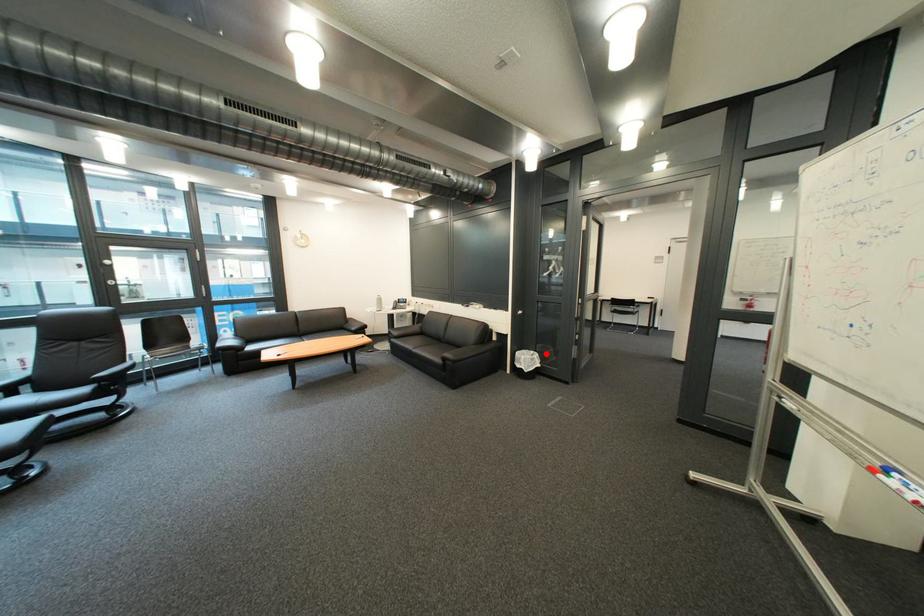
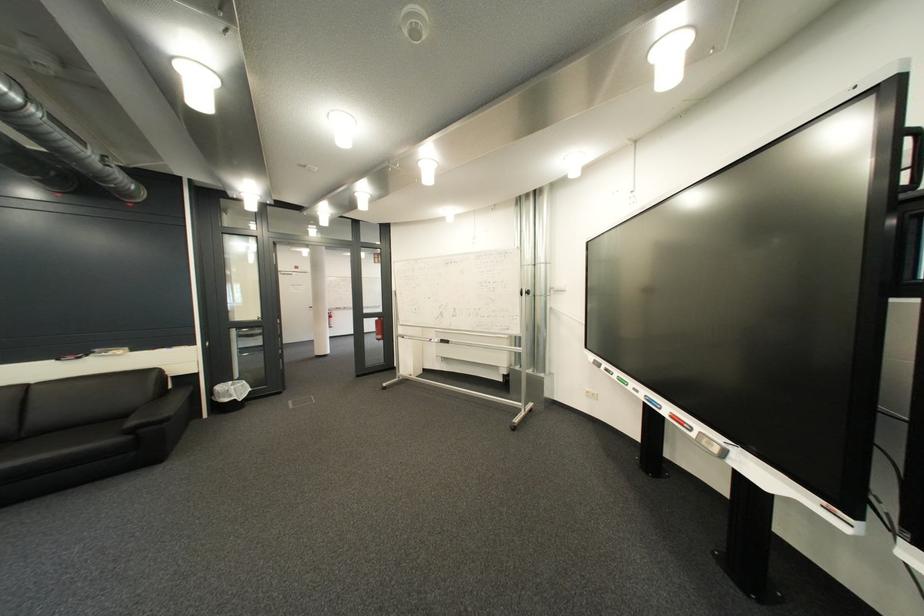
Question: A red point is marked in image1. In image2, is the corresponding 3D point closer to the camera or farther? Reply with the corresponding letter.

Choices:
 (A) The corresponding 3D point is closer.
 (B) The corresponding 3D point is farther.

Answer: (A)